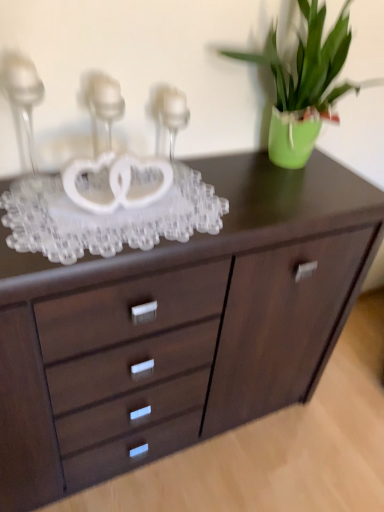
Question: Can you confirm if clear glass candle holder at upper left, acting as the first candle holder starting from the left, is positioned to the right of green matte vase at upper right?

Choices:
 (A) yes
 (B) no

Answer: (B)

Question: Is clear glass candle holder at upper left, positioned as the third candle holder in right-to-left order, facing towards green matte vase at upper right?

Choices:
 (A) no
 (B) yes

Answer: (A)

Question: Considering the relative sizes of clear glass candle holder at upper left, acting as the first candle holder starting from the left, and green matte vase at upper right in the image provided, is clear glass candle holder at upper left, acting as the first candle holder starting from the left, taller than green matte vase at upper right?

Choices:
 (A) yes
 (B) no

Answer: (B)

Question: Is the position of clear glass candle holder at upper left, positioned as the third candle holder in right-to-left order, more distant than that of green matte vase at upper right?

Choices:
 (A) no
 (B) yes

Answer: (A)

Question: Would you say clear glass candle holder at upper left, positioned as the third candle holder in right-to-left order, contains green matte vase at upper right?

Choices:
 (A) yes
 (B) no

Answer: (B)

Question: Is clear glass candle holder at upper left, acting as the 2th candle holder starting from the right, in front of or behind dark wood chest of drawers at center in the image?

Choices:
 (A) front
 (B) behind

Answer: (A)

Question: Is clear glass candle holder at upper left, the 2th candle holder positioned from the left, spatially inside dark wood chest of drawers at center, or outside of it?

Choices:
 (A) outside
 (B) inside

Answer: (A)

Question: From the image's perspective, is clear glass candle holder at upper left, the 2th candle holder positioned from the left, located above or below dark wood chest of drawers at center?

Choices:
 (A) above
 (B) below

Answer: (A)

Question: Is point (94, 131) positioned closer to the camera than point (29, 468)?

Choices:
 (A) closer
 (B) farther

Answer: (A)

Question: From the image's perspective, relative to green matte vase at upper right, is clear glass candle holder at upper left, acting as the first candle holder starting from the left, above or below?

Choices:
 (A) above
 (B) below

Answer: (B)

Question: Is point (11, 61) closer or farther from the camera than point (281, 165)?

Choices:
 (A) farther
 (B) closer

Answer: (B)

Question: Relative to green matte vase at upper right, is clear glass candle holder at upper left, acting as the first candle holder starting from the left, in front or behind?

Choices:
 (A) front
 (B) behind

Answer: (A)

Question: From their relative heights in the image, would you say clear glass candle holder at upper left, positioned as the third candle holder in right-to-left order, is taller or shorter than green matte vase at upper right?

Choices:
 (A) short
 (B) tall

Answer: (A)

Question: In the image, is clear glass candle holder at upper left, the 2th candle holder positioned from the left, positioned in front of or behind clear glass candle holder at center, placed as the first candle holder when sorted from right to left?

Choices:
 (A) front
 (B) behind

Answer: (A)

Question: Is clear glass candle holder at upper left, acting as the 2th candle holder starting from the right, wider or thinner than clear glass candle holder at center, placed as the 3th candle holder when sorted from left to right?

Choices:
 (A) wide
 (B) thin

Answer: (B)